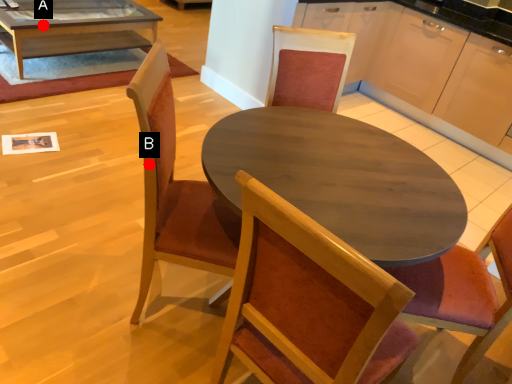
Question: Two points are circled on the image, labeled by A and B beside each circle. Which point is farther to the camera?

Choices:
 (A) A is further
 (B) B is further

Answer: (A)